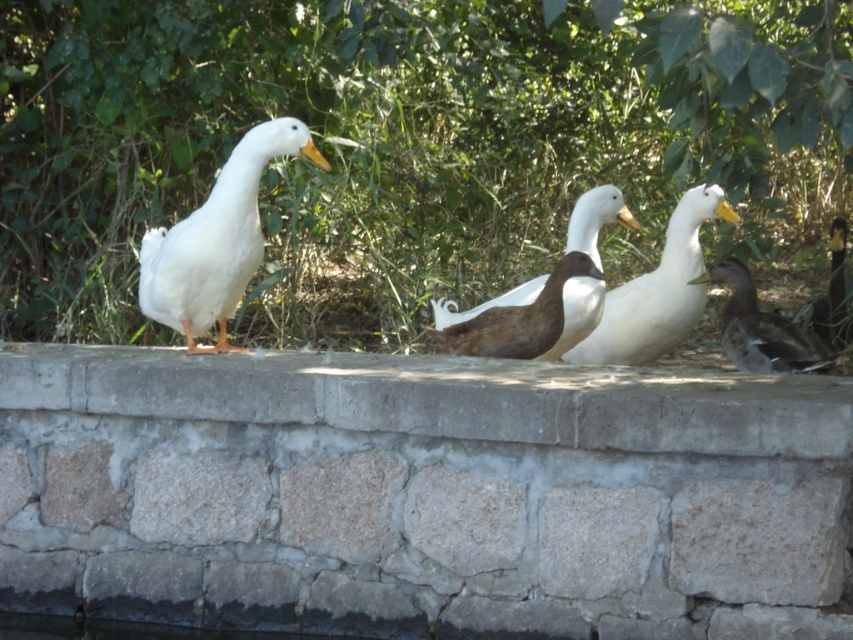
You are a photographer trying to capture the ducks on the stone ledge. You notice two points marked in the scene. Which point, point (688, 218) or point (828, 292), is closer to your camera lens?

Point (688, 218) is closer to the camera lens than point (828, 292).

You are standing in front of the stone wall where the ducks are resting. There are two points marked on the wall at coordinates point (819, 420) and point (187, 218). If you want to place a small decoration closer to your position, which point should you choose?

You should choose point (819, 420) because it is closer to the viewer than point (187, 218).